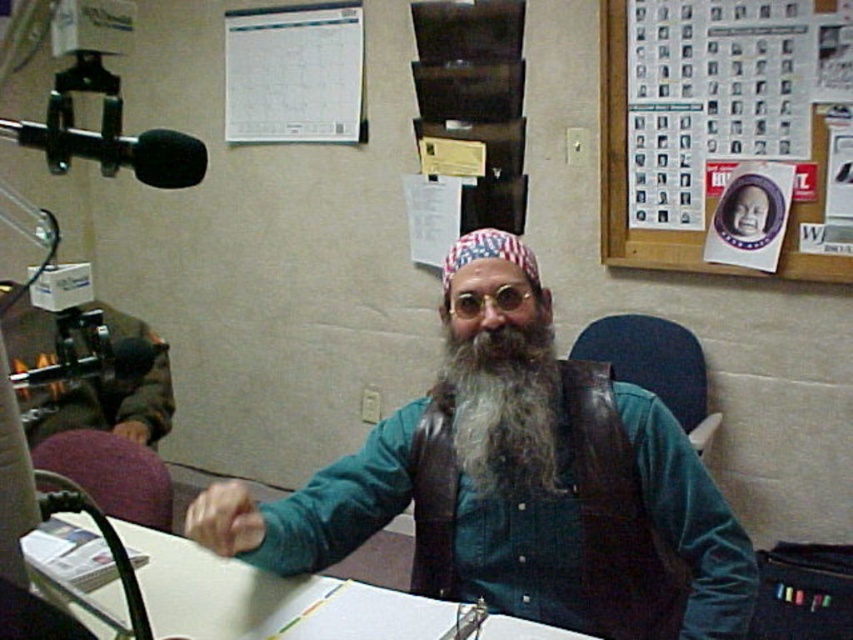
Can you confirm if green denim shirt at center is wider than graywoollybeard at center?

Indeed, green denim shirt at center has a greater width compared to graywoollybeard at center.

Which is below, green denim shirt at center or graywoollybeard at center?

green denim shirt at center

Between point (463, 321) and point (469, 396), which one is positioned behind?

The point (469, 396) is more distant.

Find the location of a particular element. This screenshot has width=853, height=640. green denim shirt at center is located at coordinates (514, 477).

In the scene shown: Is green denim shirt at center to the left of white paper at center from the viewer's perspective?

No, green denim shirt at center is not to the left of white paper at center.

Is point (755, 586) positioned after point (325, 618)?

That is True.

Find the location of a particular element. This screenshot has height=640, width=853. green denim shirt at center is located at coordinates (514, 477).

I want to click on green denim shirt at center, so click(x=514, y=477).

Is the position of green denim shirt at center more distant than that of wooden bulletin board at upper right?

No, it is in front of wooden bulletin board at upper right.

Is point (282, 508) positioned behind point (821, 115)?

No, it is in front of (821, 115).

Identify the location of green denim shirt at center. This screenshot has width=853, height=640. (514, 477).